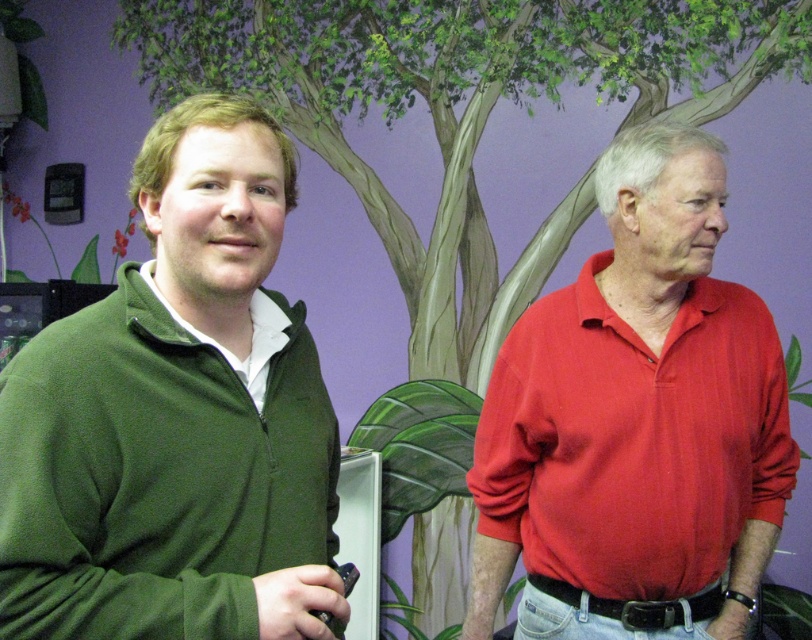
Question: Estimate the real-world distances between objects in this image. Which object is closer to the green zip-up sweater at left?

Choices:
 (A) matte red shirt at right
 (B) green fleece sweater at left

Answer: (B)

Question: Can you confirm if matte red shirt at right is positioned below green zip-up sweater at left?

Choices:
 (A) no
 (B) yes

Answer: (B)

Question: Considering the real-world distances, which object is closest to the green fleece sweater at left?

Choices:
 (A) matte red shirt at right
 (B) green zip-up sweater at left

Answer: (B)

Question: Is green fleece sweater at left above matte red shirt at right?

Choices:
 (A) yes
 (B) no

Answer: (A)

Question: Does matte red shirt at right appear on the left side of green zip-up sweater at left?

Choices:
 (A) yes
 (B) no

Answer: (B)

Question: Which point is farther from the camera taking this photo?

Choices:
 (A) (222, 348)
 (B) (609, 548)
 (C) (173, 280)

Answer: (B)